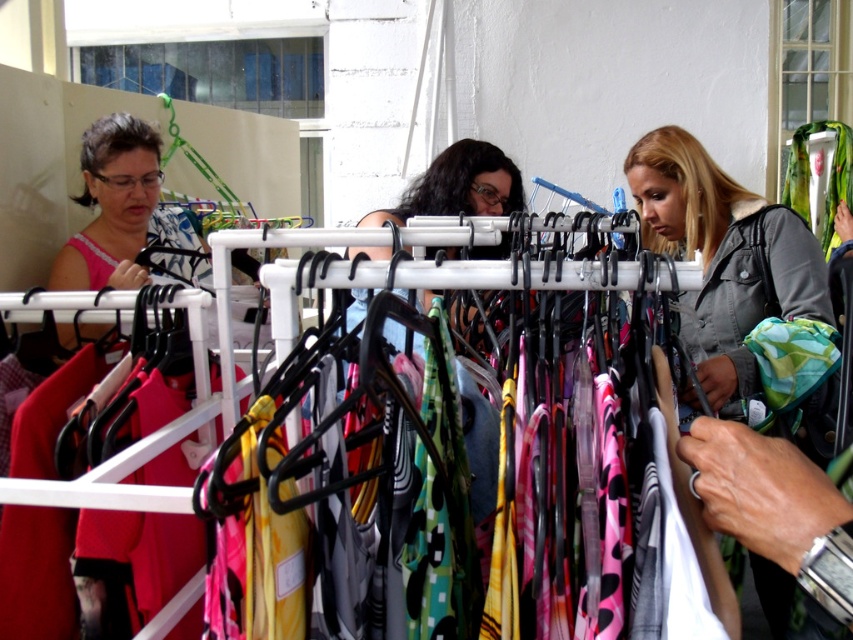
Does green and white patterned fabric at right have a greater height compared to matte black dress at center?

Indeed, green and white patterned fabric at right has a greater height compared to matte black dress at center.

Locate an element on the screen. The image size is (853, 640). green and white patterned fabric at right is located at coordinates (750, 294).

Does gray denim jacket at center have a larger size compared to green and white patterned fabric at right?

Yes.

Can you confirm if gray denim jacket at center is taller than green and white patterned fabric at right?

Indeed, gray denim jacket at center has a greater height compared to green and white patterned fabric at right.

Measure the distance between point (815, 272) and camera.

Point (815, 272) and camera are 5.96 feet apart from each other.

Image resolution: width=853 pixels, height=640 pixels. I want to click on gray denim jacket at center, so click(x=723, y=256).

Between gray denim jacket at center and matte black dress at center, which one appears on the right side from the viewer's perspective?

From the viewer's perspective, gray denim jacket at center appears more on the right side.

Is gray denim jacket at center further to camera compared to matte black dress at center?

No, it is in front of matte black dress at center.

Is point (665, 150) more distant than point (485, 141)?

That is False.

Locate an element on the screen. This screenshot has height=640, width=853. gray denim jacket at center is located at coordinates (723, 256).